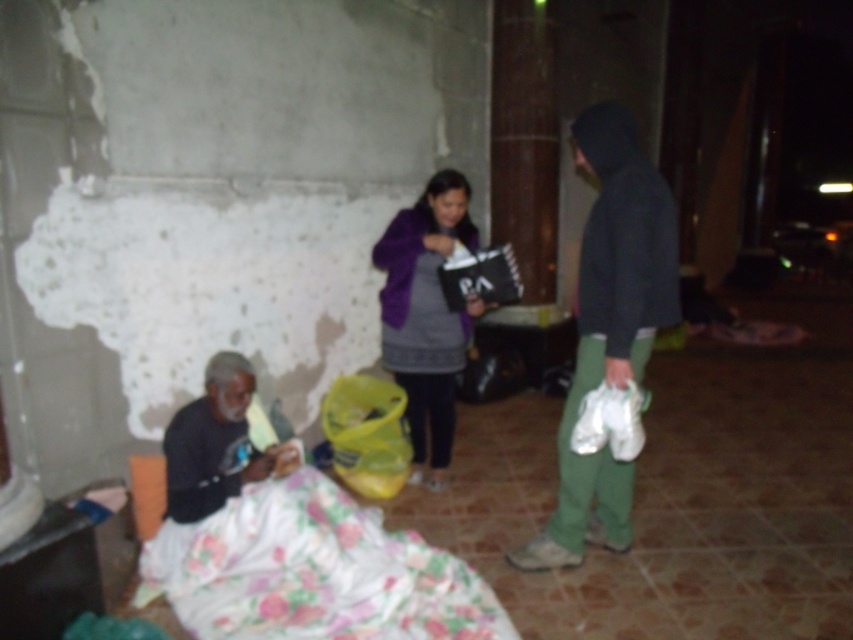
Who is more forward, (647, 346) or (227, 380)?

Positioned in front is point (227, 380).

Measure the distance between dark gray hoodie at right and camera.

dark gray hoodie at right is 2.65 meters away from camera.

This screenshot has height=640, width=853. I want to click on dark gray hoodie at right, so click(x=608, y=328).

Is black matte shirt at lower left smaller than white fabric bag at lower right?

No, black matte shirt at lower left is not smaller than white fabric bag at lower right.

Between black matte shirt at lower left and white fabric bag at lower right, which one has less height?

A: white fabric bag at lower right

Between point (231, 413) and point (641, 410), which one is positioned behind?

The point (641, 410) is behind.

Locate an element on the screen. black matte shirt at lower left is located at coordinates (213, 442).

Is point (612, 124) closer to camera compared to point (431, 422)?

Yes, it is in front of point (431, 422).

Does dark gray hoodie at right have a larger size compared to purple fleece jacket at center?

Yes.

The height and width of the screenshot is (640, 853). What are the coordinates of `dark gray hoodie at right` in the screenshot? It's located at (608, 328).